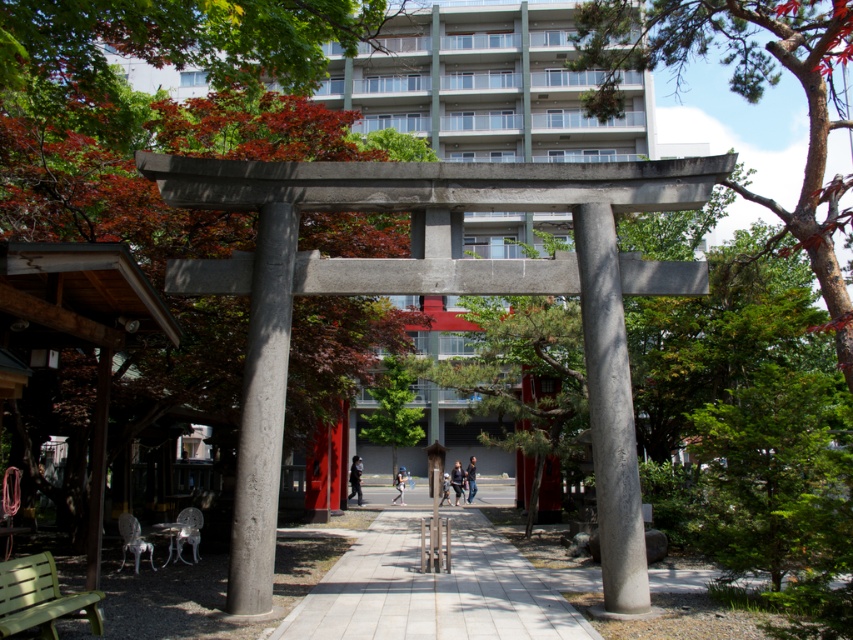
Does gray stone torii gate at center have a greater width compared to dark gray concrete statue at center?

Indeed, gray stone torii gate at center has a greater width compared to dark gray concrete statue at center.

Does gray stone torii gate at center have a larger size compared to dark gray concrete statue at center?

Correct, gray stone torii gate at center is larger in size than dark gray concrete statue at center.

Does point (606, 214) come behind point (456, 490)?

No, (606, 214) is in front of (456, 490).

Where is `gray stone torii gate at center`? The width and height of the screenshot is (853, 640). gray stone torii gate at center is located at coordinates (610, 412).

Is gray concrete pillar at center below light blue fabric at center?

No.

Does gray concrete pillar at center appear on the left side of light blue fabric at center?

Indeed, gray concrete pillar at center is positioned on the left side of light blue fabric at center.

The image size is (853, 640). In order to click on gray concrete pillar at center in this screenshot , I will do `click(262, 412)`.

The height and width of the screenshot is (640, 853). I want to click on gray concrete pillar at center, so click(x=262, y=412).

Can you confirm if gray stone torii gate at center is bigger than light gray fabric jacket at center?

No, gray stone torii gate at center is not bigger than light gray fabric jacket at center.

Does point (595, 316) come behind point (444, 480)?

No.

The height and width of the screenshot is (640, 853). What are the coordinates of `gray stone torii gate at center` in the screenshot? It's located at (610, 412).